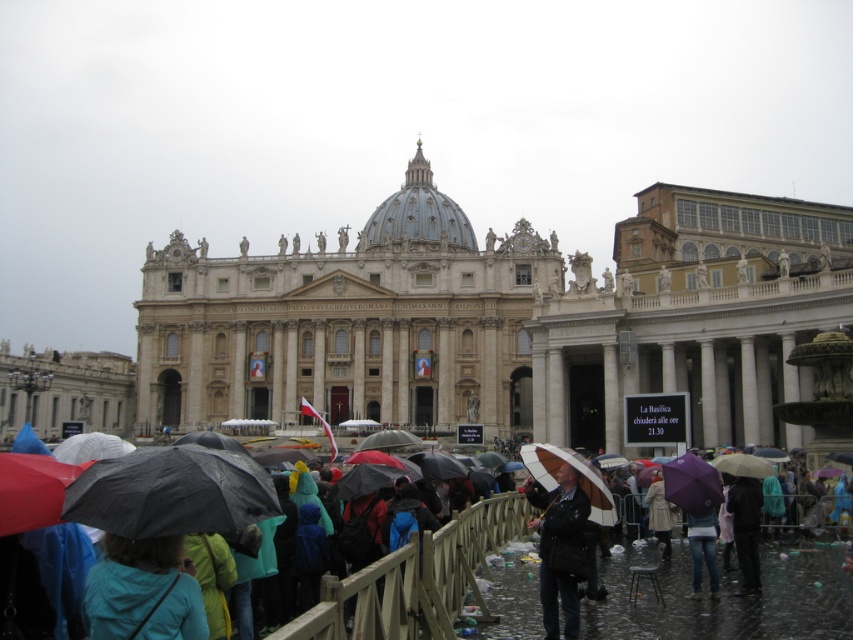
Question: Which object appears closest to the camera in this image?

Choices:
 (A) raincoat at center
 (B) black matte umbrella at lower left

Answer: (A)

Question: Does beige stone basilica at center have a smaller size compared to black matte umbrella at lower left?

Choices:
 (A) no
 (B) yes

Answer: (A)

Question: Which is nearer to the black leather jacket at lower right?

Choices:
 (A) raincoat at center
 (B) black matte umbrella at lower left

Answer: (A)

Question: Is raincoat at center thinner than black leather jacket at lower right?

Choices:
 (A) no
 (B) yes

Answer: (A)

Question: Which point is farther to the camera?

Choices:
 (A) (345, 298)
 (B) (100, 602)
 (C) (543, 531)

Answer: (A)

Question: Is beige stone basilica at center thinner than black matte umbrella at lower left?

Choices:
 (A) yes
 (B) no

Answer: (B)